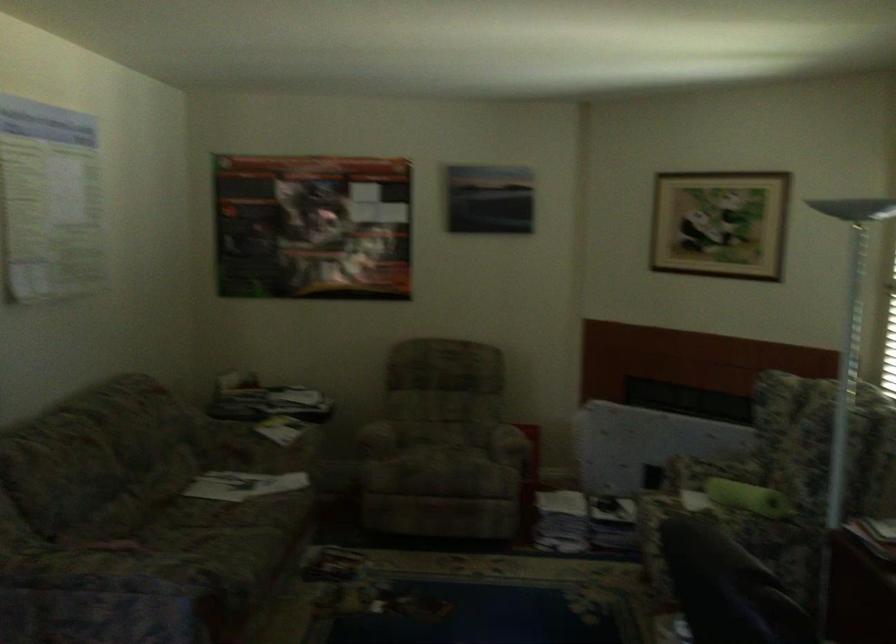
Image resolution: width=896 pixels, height=644 pixels. In order to click on sofa sitting surface in this screenshot , I will do [x=217, y=488].